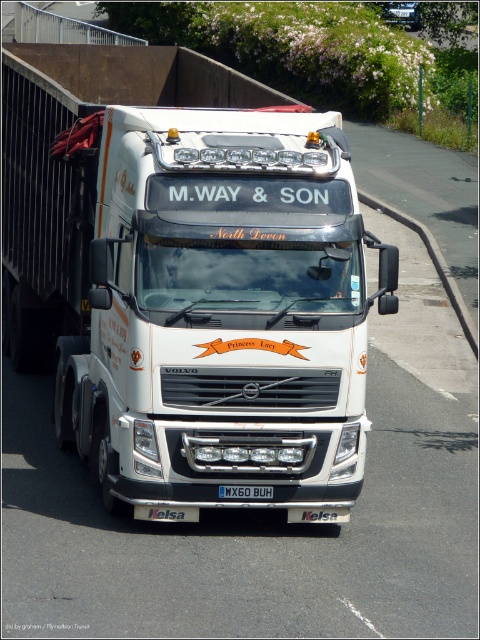
Does white glossy truck at center have a lesser height compared to black plastic license plate at center?

No.

Does point (254, 262) come in front of point (245, 493)?

Yes, point (254, 262) is closer to viewer.

Which is behind, point (62, 374) or point (249, 496)?

Point (62, 374)

Find the location of `white glossy truck at center`. white glossy truck at center is located at coordinates click(x=222, y=314).